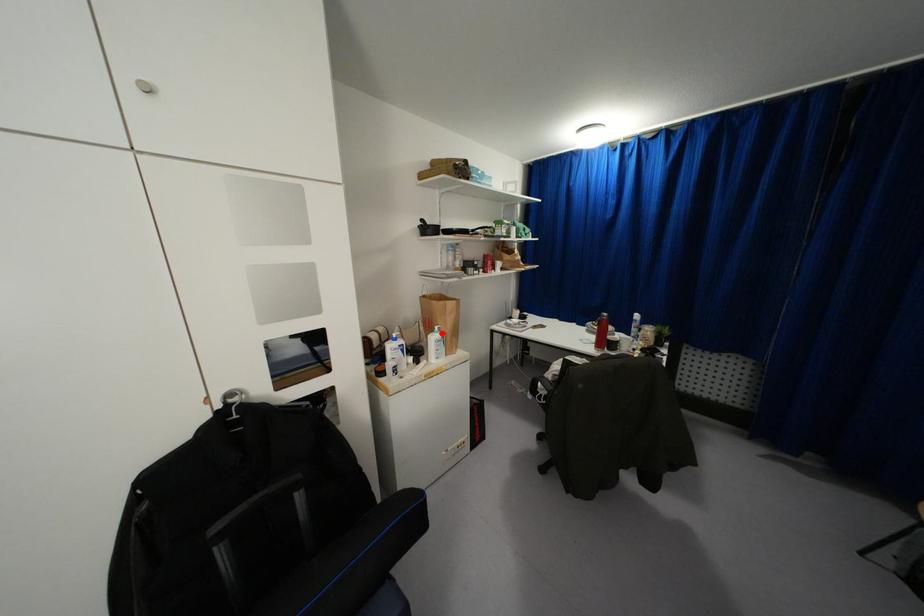
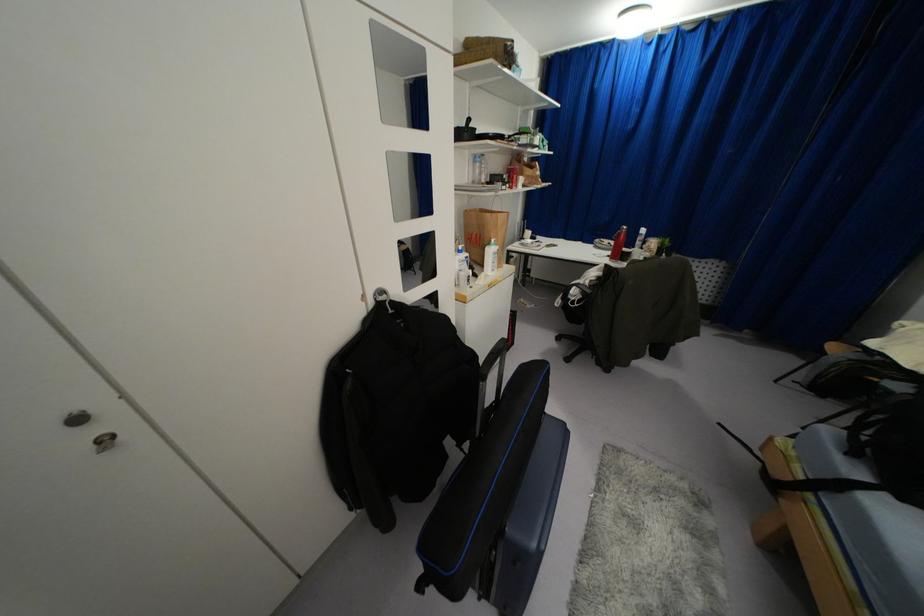
Find the pixel in the second image that matches the highlighted location in the first image.

(495, 246)